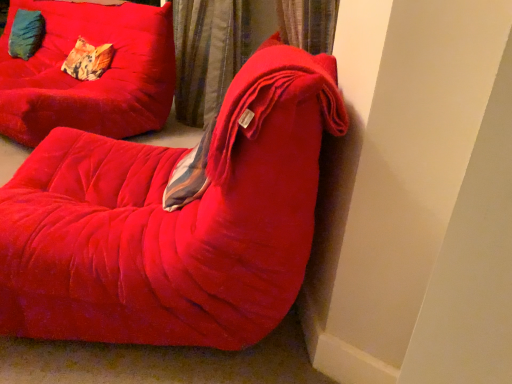
Question: Is velvet red chair at center, which is counted as the 2th furniture, starting from the back, oriented away from velvet cushion at upper left, marked as the 1th pillow in a back-to-front arrangement?

Choices:
 (A) no
 (B) yes

Answer: (A)

Question: Does velvet red chair at center, which is counted as the first furniture, starting from the front, have a greater width compared to velvet cushion at upper left, marked as the 1th pillow in a back-to-front arrangement?

Choices:
 (A) no
 (B) yes

Answer: (B)

Question: Is velvet red chair at center, which is counted as the 2th furniture, starting from the back, positioned behind velvet cushion at upper left, which appears as the 1th pillow when viewed from the left?

Choices:
 (A) yes
 (B) no

Answer: (B)

Question: Is velvet red chair at center, which is counted as the first furniture, starting from the front, not close to velvet cushion at upper left, which is the 2th pillow in right-to-left order?

Choices:
 (A) no
 (B) yes

Answer: (B)

Question: Does velvet red chair at center, which is counted as the 2th furniture, starting from the back, lie in front of velvet cushion at upper left, which is the 2th pillow in right-to-left order?

Choices:
 (A) no
 (B) yes

Answer: (B)

Question: From a real-world perspective, is patterned fabric pillow at upper left, the 2th pillow in the back-to-front sequence, positioned above or below velvet red couch at center, positioned as the second furniture in front-to-back order?

Choices:
 (A) above
 (B) below

Answer: (A)

Question: Which is correct: patterned fabric pillow at upper left, the 2th pillow in the back-to-front sequence, is inside velvet red couch at center, positioned as the second furniture in front-to-back order, or outside of it?

Choices:
 (A) inside
 (B) outside

Answer: (A)

Question: Visually, is patterned fabric pillow at upper left, which is counted as the 1th pillow, starting from the front, positioned to the left or to the right of velvet red couch at center, positioned as the second furniture in front-to-back order?

Choices:
 (A) right
 (B) left

Answer: (A)

Question: Considering the positions of patterned fabric pillow at upper left, which is counted as the 1th pillow, starting from the front, and velvet red couch at center, positioned as the second furniture in front-to-back order, in the image, is patterned fabric pillow at upper left, which is counted as the 1th pillow, starting from the front, wider or thinner than velvet red couch at center, positioned as the second furniture in front-to-back order,?

Choices:
 (A) wide
 (B) thin

Answer: (B)

Question: In terms of size, does velvet curtain at upper center appear bigger or smaller than velvet red couch at center, positioned as the second furniture in front-to-back order?

Choices:
 (A) small
 (B) big

Answer: (A)

Question: From the image's perspective, is velvet curtain at upper center located above or below velvet red couch at center, positioned as the second furniture in front-to-back order?

Choices:
 (A) above
 (B) below

Answer: (B)

Question: Considering the positions of velvet curtain at upper center and velvet red couch at center, which is the first furniture in back-to-front order, in the image, is velvet curtain at upper center wider or thinner than velvet red couch at center, which is the first furniture in back-to-front order,?

Choices:
 (A) thin
 (B) wide

Answer: (A)

Question: Considering the positions of velvet curtain at upper center and velvet red couch at center, which is the first furniture in back-to-front order, in the image, is velvet curtain at upper center taller or shorter than velvet red couch at center, which is the first furniture in back-to-front order,?

Choices:
 (A) tall
 (B) short

Answer: (A)

Question: Considering the positions of velvet cushion at upper left, marked as the 1th pillow in a back-to-front arrangement, and velvet curtain at upper center in the image, is velvet cushion at upper left, marked as the 1th pillow in a back-to-front arrangement, taller or shorter than velvet curtain at upper center?

Choices:
 (A) tall
 (B) short

Answer: (B)

Question: Considering the relative positions of velvet cushion at upper left, marked as the 1th pillow in a back-to-front arrangement, and velvet curtain at upper center in the image provided, is velvet cushion at upper left, marked as the 1th pillow in a back-to-front arrangement, to the left or to the right of velvet curtain at upper center?

Choices:
 (A) right
 (B) left

Answer: (B)